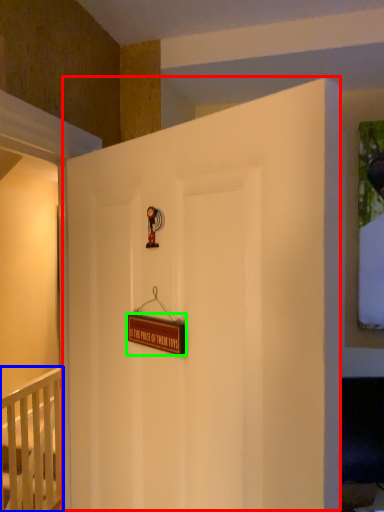
Question: Which object is the farthest from door (highlighted by a red box)? Choose among these: infant bed (highlighted by a blue box) or plaque (highlighted by a green box).

Choices:
 (A) infant bed
 (B) plaque

Answer: (A)